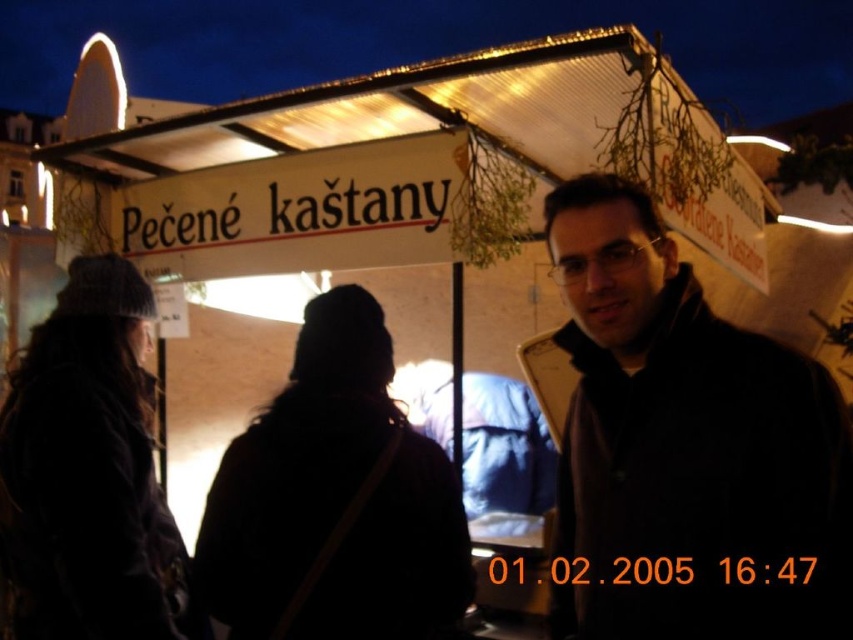
Is point (590, 476) less distant than point (57, 413)?

Yes, it is.

Who is more forward, (811, 460) or (131, 516)?

Point (811, 460)

The height and width of the screenshot is (640, 853). What are the coordinates of `black matte jacket at center` in the screenshot? It's located at (686, 449).

Who is taller, black woolen hat at center or knitted wool hat at left?

With more height is knitted wool hat at left.

Which of these two, black woolen hat at center or knitted wool hat at left, stands shorter?

Standing shorter between the two is black woolen hat at center.

This screenshot has width=853, height=640. What do you see at coordinates (335, 500) in the screenshot?
I see `black woolen hat at center` at bounding box center [335, 500].

The width and height of the screenshot is (853, 640). Identify the location of black woolen hat at center. point(335,500).

Is black matte jacket at center wider than black woolen hat at center?

In fact, black matte jacket at center might be narrower than black woolen hat at center.

At what (x,y) coordinates should I click in order to perform the action: click on black matte jacket at center. Please return your answer as a coordinate pair (x, y). Image resolution: width=853 pixels, height=640 pixels. Looking at the image, I should click on (686, 449).